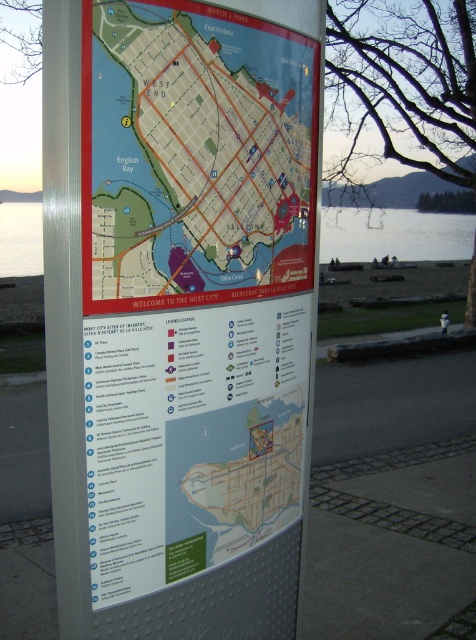
You are a tourist holding a compass and standing at the point marked by the coordinates point (195,156) on the map. You want to walk directly north to reach the nearest landmark. Which direction should you face according to the map?

The point (195,156) on the map indicates the matte paper map at center. Since the map is oriented with north at the top, you should face the top of the map to walk directly north.

You are standing in front of a vertical pole with the matte paper map at center. You want to read the map but you have a 1.20 meter long umbrella in your hand. Can you hold the umbrella vertically without it touching the ground while reading the map?

The matte paper map at center is 1.30 meters from viewer. Since the umbrella is 1.20 meters long, you can hold it vertically while reading the map as the distance allows enough space between the map and the ground.

You are a tourist holding a compass and standing in front of the matte paper map at center. The compass points north. According to the map, which direction would you face to see the clear water at lower left from your current position?

Since the matte paper map at center is in front of clear water at lower left, facing north on the compass, the clear water at lower left would be to your south direction.